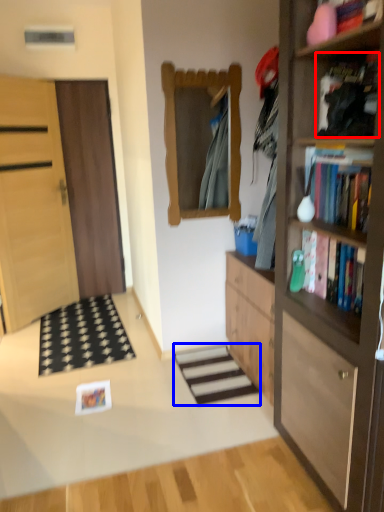
Question: Which object is further to the camera taking this photo, book (highlighted by a red box) or stairwell (highlighted by a blue box)?

Choices:
 (A) book
 (B) stairwell

Answer: (B)